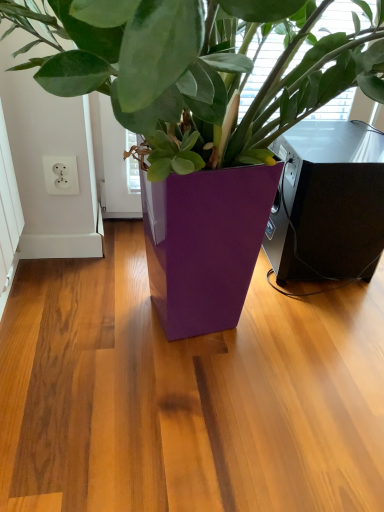
Locate an element on the screen. Image resolution: width=384 pixels, height=512 pixels. metallic black speaker at right is located at coordinates (328, 202).

Image resolution: width=384 pixels, height=512 pixels. What do you see at coordinates (328, 202) in the screenshot?
I see `metallic black speaker at right` at bounding box center [328, 202].

Identify the location of metallic black speaker at right. This screenshot has width=384, height=512. (328, 202).